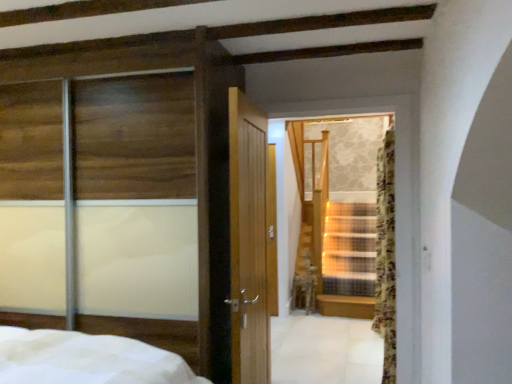
Describe the element at coordinates (248, 242) in the screenshot. The image size is (512, 384). I see `transparent glass stairs at center` at that location.

Describe the element at coordinates (386, 256) in the screenshot. This screenshot has width=512, height=384. I see `floral fabric curtain at right` at that location.

Identify the location of transparent glass stairs at center. (248, 242).

Which point is more forward, (384, 214) or (46, 285)?

The point (46, 285) is closer.

This screenshot has width=512, height=384. I want to click on curtain on the right of transparent glass sliding door at left, so click(x=386, y=256).

Is floral fabric curtain at right situated inside transparent glass sliding door at left or outside?

floral fabric curtain at right lies outside transparent glass sliding door at left.

Are floral fabric curtain at right and transparent glass stairs at center located far from each other?

Actually, floral fabric curtain at right and transparent glass stairs at center are a little close together.

From a real-world perspective, which object rests below the other?

floral fabric curtain at right is physically lower.

From the image's perspective, is floral fabric curtain at right located above or below transparent glass stairs at center?

floral fabric curtain at right is situated lower than transparent glass stairs at center in the image.

Does point (381, 277) come closer to viewer compared to point (234, 323)?

No, it is not.

Considering their positions, is transparent glass sliding door at left located in front of or behind transparent glass stairs at center?

Visually, transparent glass sliding door at left is located in front of transparent glass stairs at center.

From a real-world perspective, who is located higher, transparent glass sliding door at left or transparent glass stairs at center?

From a 3D spatial view, transparent glass sliding door at left is above.

Consider the image. Which object is positioned more to the left, transparent glass sliding door at left or transparent glass stairs at center?

Positioned to the left is transparent glass sliding door at left.

Would you say transparent glass sliding door at left is a long distance from transparent glass stairs at center?

No, transparent glass sliding door at left is in close proximity to transparent glass stairs at center.

How many degrees apart are the facing directions of transparent glass stairs at center and transparent glass sliding door at left?

1.18 degrees separate the facing orientations of transparent glass stairs at center and transparent glass sliding door at left.

Do you think transparent glass stairs at center is within transparent glass sliding door at left, or outside of it?

transparent glass stairs at center is located beyond the bounds of transparent glass sliding door at left.

Is transparent glass stairs at center touching transparent glass sliding door at left?

There is a gap between transparent glass stairs at center and transparent glass sliding door at left.

Considering the relative sizes of transparent glass stairs at center and transparent glass sliding door at left in the image provided, is transparent glass stairs at center smaller than transparent glass sliding door at left?

Correct, transparent glass stairs at center occupies less space than transparent glass sliding door at left.

Between point (142, 185) and point (389, 306), which one is positioned behind?

The point (389, 306) is behind.

Based on the photo, from the image's perspective, is transparent glass sliding door at left located above or below floral fabric curtain at right?

Based on their image positions, transparent glass sliding door at left is located above floral fabric curtain at right.

Considering the relative positions of transparent glass sliding door at left and floral fabric curtain at right in the image provided, is transparent glass sliding door at left to the right of floral fabric curtain at right from the viewer's perspective?

No.

From the picture: Between transparent glass sliding door at left and floral fabric curtain at right, which one has smaller width?

With smaller width is floral fabric curtain at right.

Is transparent glass stairs at center facing towards floral fabric curtain at right?

No, transparent glass stairs at center does not turn towards floral fabric curtain at right.

Looking at this image, from their relative heights in the image, would you say transparent glass stairs at center is taller or shorter than floral fabric curtain at right?

transparent glass stairs at center is shorter than floral fabric curtain at right.

Consider the image. In the image, is transparent glass stairs at center positioned in front of or behind floral fabric curtain at right?

transparent glass stairs at center is in front of floral fabric curtain at right.

Is point (260, 256) positioned in front of point (386, 179)?

That is True.

The height and width of the screenshot is (384, 512). Identify the location of window on the left of the floral fabric curtain at right. (136, 198).

Find the location of `glass door above the floral fabric curtain at right (from a real-world perspective)`. glass door above the floral fabric curtain at right (from a real-world perspective) is located at coordinates (248, 242).

Based on their spatial positions, is transparent glass stairs at center or floral fabric curtain at right further from transparent glass sliding door at left?

Based on the image, floral fabric curtain at right appears to be further to transparent glass sliding door at left.

When comparing their distances from transparent glass stairs at center, does transparent glass sliding door at left or floral fabric curtain at right seem further?

The object further to transparent glass stairs at center is floral fabric curtain at right.

Based on their spatial positions, is floral fabric curtain at right or transparent glass sliding door at left closer to transparent glass stairs at center?

transparent glass sliding door at left lies closer to transparent glass stairs at center than the other object.

Looking at the image, which one is located further to floral fabric curtain at right, transparent glass sliding door at left or transparent glass stairs at center?

transparent glass sliding door at left is further to floral fabric curtain at right.

Looking at the image, which one is located closer to transparent glass sliding door at left, floral fabric curtain at right or transparent glass stairs at center?

transparent glass stairs at center.

From the image, which object appears to be farther from floral fabric curtain at right, transparent glass stairs at center or transparent glass sliding door at left?

transparent glass sliding door at left is positioned further to the anchor floral fabric curtain at right.

Locate an element on the screen. The image size is (512, 384). glass door situated between transparent glass sliding door at left and floral fabric curtain at right from left to right is located at coordinates (248, 242).